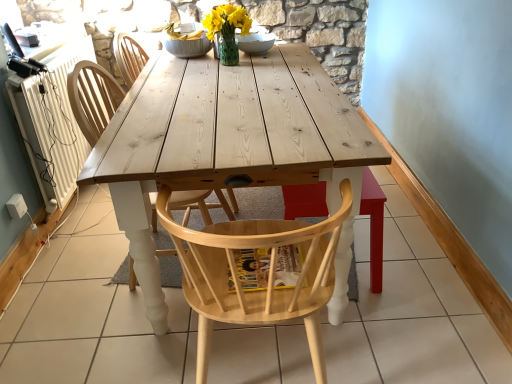
Question: In which direction should I rotate to look at natural wood chair at center, which ranks as the 3th chair in back-to-front order?

Choices:
 (A) right
 (B) left

Answer: (A)

Question: Would you say polka dot glass vase at center is a long distance from natural wood chair at center, the second chair when ordered from front to back?

Choices:
 (A) yes
 (B) no

Answer: (B)

Question: Is polka dot glass vase at center bigger than natural wood chair at center, the second chair when ordered from front to back?

Choices:
 (A) yes
 (B) no

Answer: (B)

Question: Can you confirm if polka dot glass vase at center is thinner than natural wood chair at center, the second chair when ordered from front to back?

Choices:
 (A) no
 (B) yes

Answer: (B)

Question: Is polka dot glass vase at center facing towards natural wood chair at center, the second chair when ordered from front to back?

Choices:
 (A) yes
 (B) no

Answer: (B)

Question: Is polka dot glass vase at center not within natural wood chair at center, the 2th chair viewed from the back?

Choices:
 (A) yes
 (B) no

Answer: (A)

Question: From a real-world perspective, is polka dot glass vase at center located beneath natural wood chair at center, the 2th chair viewed from the back?

Choices:
 (A) yes
 (B) no

Answer: (B)

Question: Does white ceramic bowl at center have a greater width compared to natural wood chair at center, the 1th chair when ordered from back to front?

Choices:
 (A) yes
 (B) no

Answer: (B)

Question: Does white ceramic bowl at center contain natural wood chair at center, the 1th chair when ordered from back to front?

Choices:
 (A) no
 (B) yes

Answer: (A)

Question: Is white ceramic bowl at center thinner than natural wood chair at center, the 1th chair when ordered from back to front?

Choices:
 (A) no
 (B) yes

Answer: (B)

Question: From a real-world perspective, does white ceramic bowl at center stand above natural wood chair at center, the 3th chair viewed from the front?

Choices:
 (A) yes
 (B) no

Answer: (A)

Question: Does white ceramic bowl at center have a lesser height compared to natural wood chair at center, the 1th chair when ordered from back to front?

Choices:
 (A) no
 (B) yes

Answer: (B)

Question: Is white ceramic bowl at center at the right side of natural wood chair at center, the 3th chair viewed from the front?

Choices:
 (A) no
 (B) yes

Answer: (B)

Question: Does polka dot glass vase at center have a lesser width compared to white ceramic bowl at center?

Choices:
 (A) yes
 (B) no

Answer: (A)